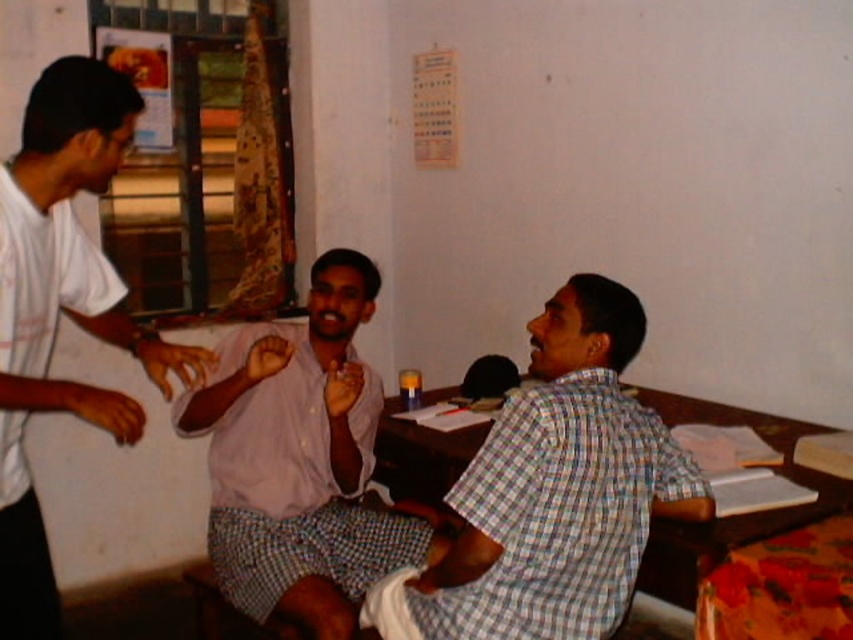
Can you confirm if white cotton shirt at left is positioned below wooden at right?

Incorrect, white cotton shirt at left is not positioned below wooden at right.

I want to click on white cotton shirt at left, so click(x=62, y=308).

Who is more forward, (x=73, y=304) or (x=810, y=509)?

Point (x=810, y=509) is in front.

The height and width of the screenshot is (640, 853). What are the coordinates of `white cotton shirt at left` in the screenshot? It's located at (x=62, y=308).

Who is shorter, light pink shirt at center or wooden at right?

With less height is wooden at right.

Is point (248, 460) more distant than point (787, 448)?

No, (248, 460) is closer to viewer.

You are a GUI agent. You are given a task and a screenshot of the screen. Output one action in this format:
    pyautogui.click(x=<x>, y=<y>)
    Task: Click on the light pink shirt at center
    This screenshot has width=853, height=640.
    Given the screenshot: What is the action you would take?
    pyautogui.click(x=300, y=460)

Is point (312, 593) positioned before point (51, 92)?

No, it is not.

Is light pink shirt at center below white cotton shirt at left?

Yes.

This screenshot has height=640, width=853. Identify the location of light pink shirt at center. (300, 460).